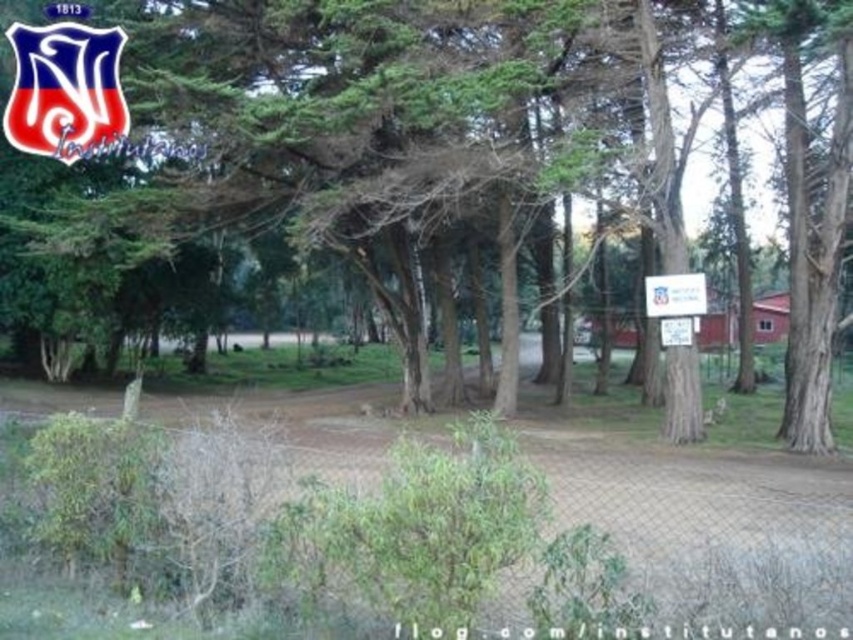
Question: Which point is closer to the camera?

Choices:
 (A) (538, 156)
 (B) (115, 131)

Answer: (A)

Question: Which object appears farthest from the camera in this image?

Choices:
 (A) white plastic sign at center
 (B) matte plastic logo at upper left
 (C) green textured tree at center

Answer: (B)

Question: Estimate the real-world distances between objects in this image. Which object is closer to the green textured tree at center?

Choices:
 (A) matte plastic logo at upper left
 (B) white plastic sign at center

Answer: (A)

Question: Is green textured tree at center positioned behind white plastic sign at center?

Choices:
 (A) yes
 (B) no

Answer: (B)

Question: Does matte plastic logo at upper left have a smaller size compared to white plastic sign at center?

Choices:
 (A) yes
 (B) no

Answer: (B)

Question: Can you confirm if green textured tree at center is positioned to the right of white plastic sign at center?

Choices:
 (A) no
 (B) yes

Answer: (A)